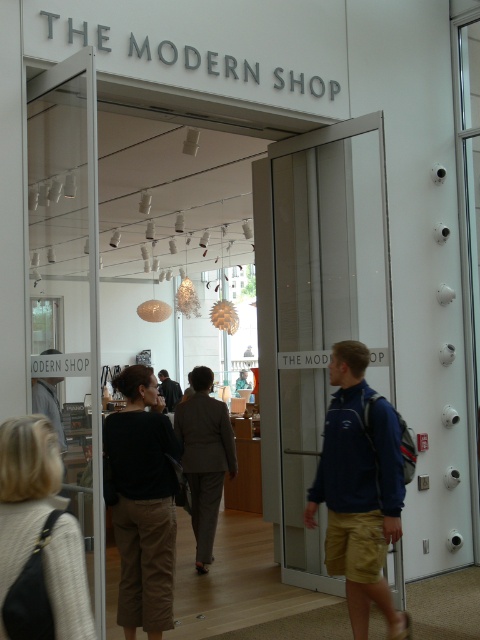
You are a customer looking to try on the gray fabric suit at center and the dark gray suit at center displayed in The Modern Shop. Which suit should you pick up first if you want to try the one that is placed higher?

You should pick up the gray fabric suit at center first since it is placed above the dark gray suit at center, making it more accessible.

You are a customer standing outside The Modern Shop looking through the glass doors. You see a light beige sweater at lower left and a gray fabric suit at center. Which item is positioned higher in the display?

The light beige sweater at lower left is positioned higher than the gray fabric suit at center in the display.

You are standing at the entrance of The Modern Shop and see two points marked in the scene. Which point is closer to the camera? Please choose between point (369, 524) and point (60, 458).

Point (60, 458) is closer to the camera because it is in front of point (369, 524).